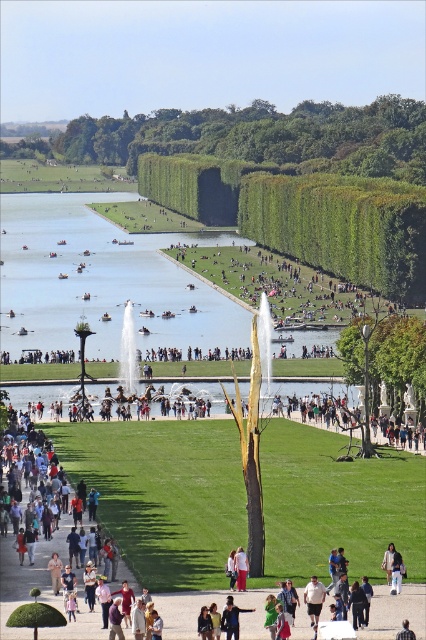
You are standing at the edge of the canal in the grand garden and want to take a photo of both point (319,593) and point (409,632). Which point will appear closer to the bottom of your camera viewfinder?

Point (319,593) is further to the camera than point (409,632). Therefore, point (409,632) will appear closer to the bottom of the camera viewfinder since it is closer to the viewer.

You are a visitor in the park and want to take a photo of the green leafy tree at upper center without the white cotton shirt at center blocking the view. Is the tree large enough to be seen clearly even if the shirt is in front of it?

The green leafy tree at upper center is larger in size than the white cotton shirt at center, so it should still be visible even if the shirt is in front, as the tree is bigger and might extend beyond the shirt.

You are planning to take a photo of the green leafy tree at upper center and the white cotton shirt at center from a distance. Can you fit both subjects into the frame of a standard camera without zooming? Explain your reasoning based on their distance apart.

The green leafy tree at upper center and the white cotton shirt at center are 319.00 meters apart. A standard camera has a maximum field of view that can capture approximately 5 meters at a distance of 10 meters. At 319 meters apart, the distance is far beyond the camera lens capability to capture both subjects in a single frame without zooming. Therefore, it would not be possible to fit both into the frame without using a zoom lens.